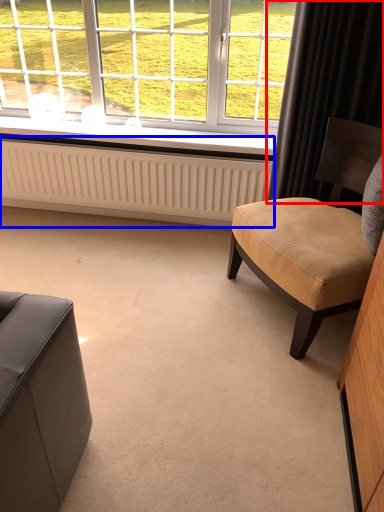
Question: Which of the following is the closest to the observer, curtain (highlighted by a red box) or radiator (highlighted by a blue box)?

Choices:
 (A) curtain
 (B) radiator

Answer: (A)